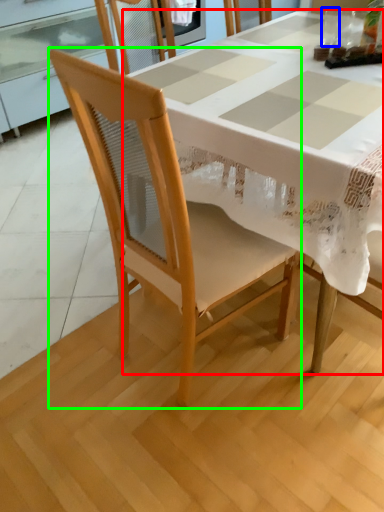
Question: Based on their relative distances, which object is nearer to table (highlighted by a red box)? Choose from tableware (highlighted by a blue box) and chair (highlighted by a green box).

Choices:
 (A) tableware
 (B) chair

Answer: (B)